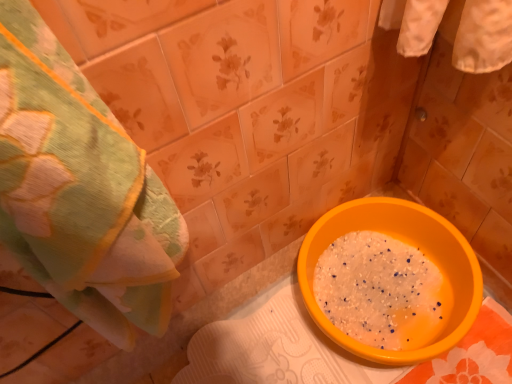
Question: Is green textured towel at left at the left side of orange plastic basin at lower right?

Choices:
 (A) no
 (B) yes

Answer: (B)

Question: Does green textured towel at left have a greater height compared to orange plastic basin at lower right?

Choices:
 (A) no
 (B) yes

Answer: (B)

Question: Considering the relative positions of green textured towel at left and orange plastic basin at lower right in the image provided, is green textured towel at left in front of orange plastic basin at lower right?

Choices:
 (A) yes
 (B) no

Answer: (A)

Question: Is green textured towel at left oriented away from orange plastic basin at lower right?

Choices:
 (A) yes
 (B) no

Answer: (B)

Question: From a real-world perspective, does green textured towel at left stand above orange plastic basin at lower right?

Choices:
 (A) yes
 (B) no

Answer: (A)

Question: Would you say green textured towel at left contains orange plastic basin at lower right?

Choices:
 (A) no
 (B) yes

Answer: (A)

Question: Is orange plastic basin at lower right oriented away from green textured towel at left?

Choices:
 (A) yes
 (B) no

Answer: (B)

Question: Is orange plastic basin at lower right not close to green textured towel at left?

Choices:
 (A) yes
 (B) no

Answer: (B)

Question: Does orange plastic basin at lower right lie in front of green textured towel at left?

Choices:
 (A) yes
 (B) no

Answer: (B)

Question: Does orange plastic basin at lower right appear on the left side of green textured towel at left?

Choices:
 (A) no
 (B) yes

Answer: (A)

Question: Does orange plastic basin at lower right have a lesser width compared to green textured towel at left?

Choices:
 (A) no
 (B) yes

Answer: (A)

Question: Can you confirm if orange plastic basin at lower right is wider than green textured towel at left?

Choices:
 (A) no
 (B) yes

Answer: (B)

Question: From the image's perspective, is orange plastic basin at lower right located above or below green textured towel at left?

Choices:
 (A) above
 (B) below

Answer: (B)